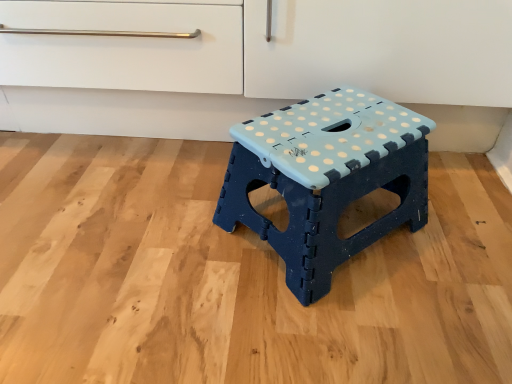
Find the location of a particular element. Image resolution: width=512 pixels, height=384 pixels. vacant area located to the right-hand side of blue textured stool at center is located at coordinates (455, 234).